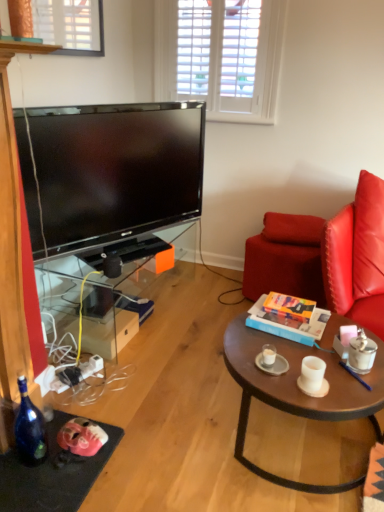
You are a GUI agent. You are given a task and a screenshot of the screen. Output one action in this format:
    pyautogui.click(x=<x>, y=<y>)
    Task: Click on the vacant space behind matte gray saucer at center
    The width and height of the screenshot is (384, 512).
    Given the screenshot: What is the action you would take?
    pyautogui.click(x=261, y=339)